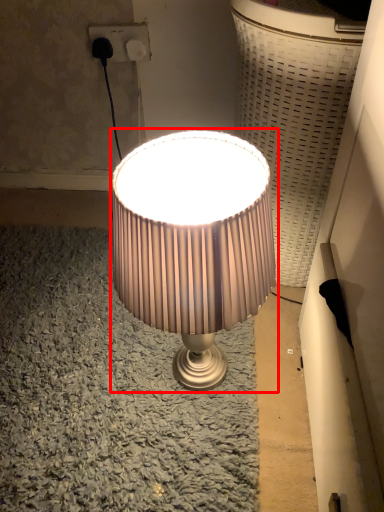
Question: Observing the image, what is the correct spatial positioning of lamp (annotated by the red box) in reference to electric outlet?

Choices:
 (A) left
 (B) right

Answer: (B)